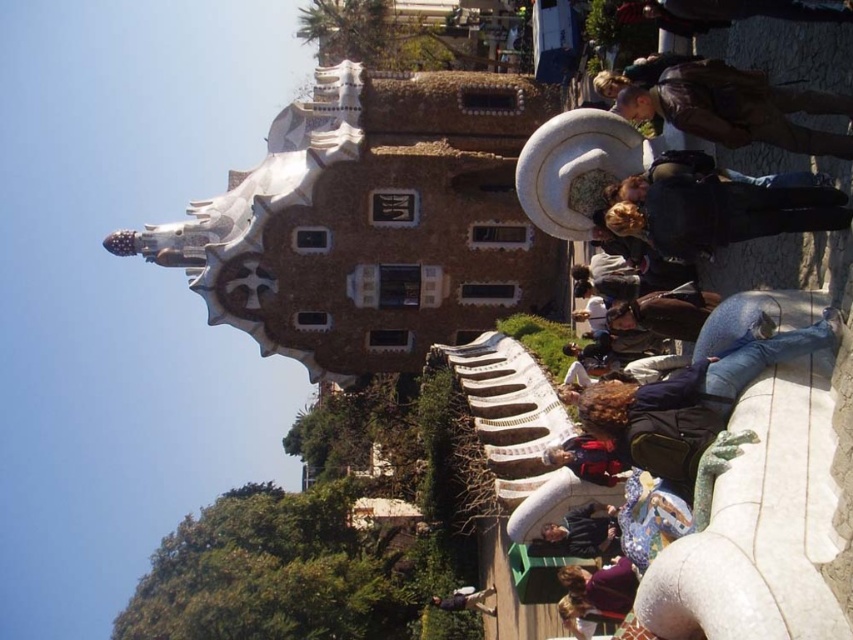
Question: Considering the relative positions of blue jeans at lower right and purple matte shirt at lower center in the image provided, where is blue jeans at lower right located with respect to purple matte shirt at lower center?

Choices:
 (A) below
 (B) above

Answer: (B)

Question: Which of these objects is positioned farthest from the purple matte shirt at lower center?

Choices:
 (A) red fabric jacket at center
 (B) brown leather jacket at upper right
 (C) dark blue jeans at lower center

Answer: (C)

Question: Which point is farther from the camera taking this photo?

Choices:
 (A) (606, 592)
 (B) (596, 540)
 (C) (648, 442)

Answer: (B)

Question: Which point appears closest to the camera in this image?

Choices:
 (A) (595, 438)
 (B) (842, 113)
 (C) (630, 392)

Answer: (B)

Question: Can you confirm if black leather jacket at upper right is smaller than purple matte shirt at lower center?

Choices:
 (A) no
 (B) yes

Answer: (A)

Question: Can you confirm if purple matte shirt at lower center is positioned to the right of dark blue jacket at lower center?

Choices:
 (A) no
 (B) yes

Answer: (B)